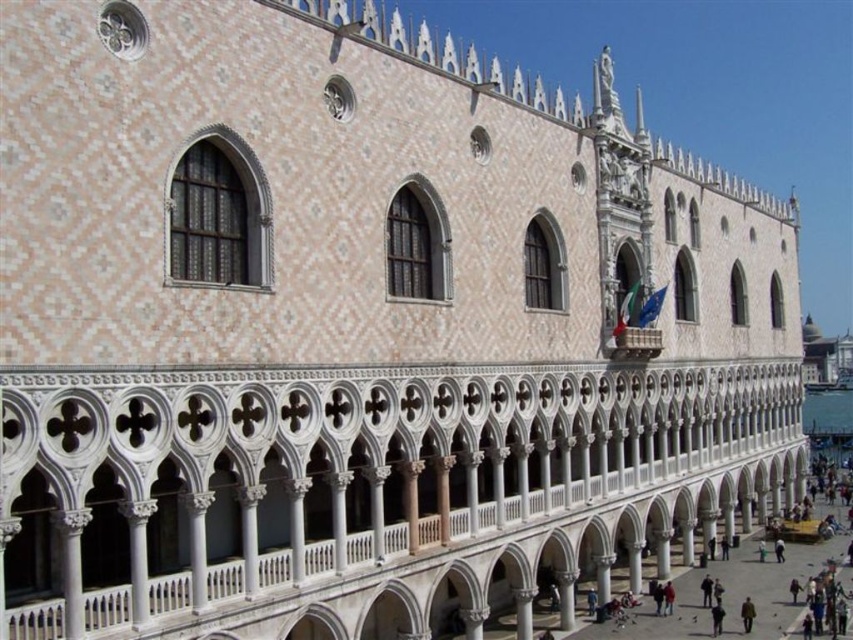
Does point (358, 557) lie behind point (715, 621)?

No, (358, 557) is closer to viewer.

Which is in front, point (317, 481) or point (717, 612)?

Point (317, 481) is in front.

Does point (415, 394) come closer to viewer compared to point (718, 630)?

Yes, it is.

At what (x,y) coordinates should I click in order to perform the action: click on white stone balcony at center. Please return your answer as a coordinate pair (x, y). This screenshot has width=853, height=640. Looking at the image, I should click on (366, 486).

Between white stone balcony at center and green fabric coat at center, which one is positioned higher?

Positioned higher is white stone balcony at center.

Is white stone balcony at center further to the viewer compared to green fabric coat at center?

No, white stone balcony at center is in front of green fabric coat at center.

Which is behind, point (300, 468) or point (750, 609)?

Point (750, 609)

Where is `white stone balcony at center`? This screenshot has width=853, height=640. white stone balcony at center is located at coordinates (366, 486).

Is green fabric coat at center closer to the viewer compared to dark gray fabric person at lower right?

No, it is behind dark gray fabric person at lower right.

Can you confirm if green fabric coat at center is shorter than dark gray fabric person at lower right?

Incorrect, green fabric coat at center's height does not fall short of dark gray fabric person at lower right's.

Who is more forward, (751,612) or (714,614)?

Point (751,612)

The width and height of the screenshot is (853, 640). Identify the location of green fabric coat at center. (747, 614).